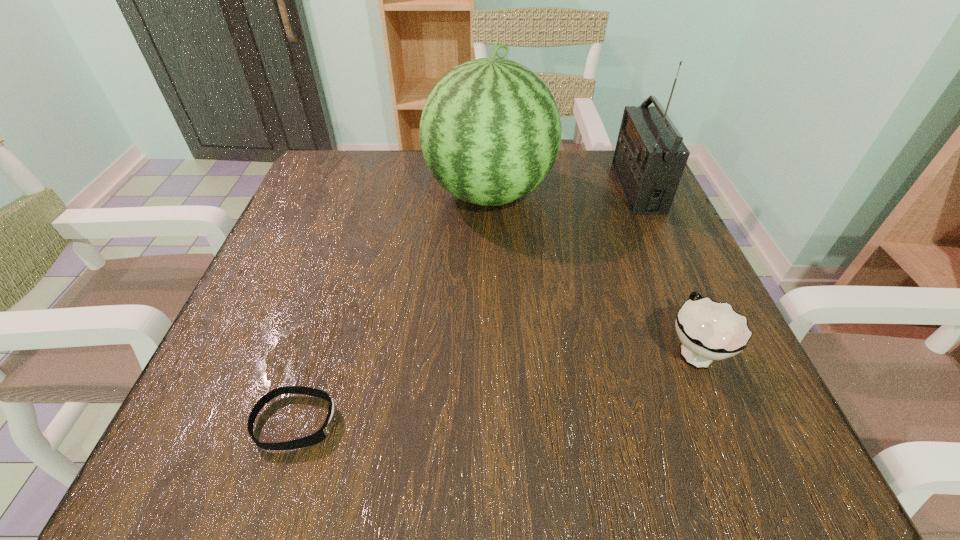
Find the location of a particular element. The image size is (960, 540). free spot between the second nearest object and the second object from left to right is located at coordinates (591, 271).

You are a GUI agent. You are given a task and a screenshot of the screen. Output one action in this format:
    pyautogui.click(x=<x>, y=<y>)
    Task: Click on the vacant space in between the watermelon and the second nearest object
    This screenshot has width=960, height=540.
    Given the screenshot: What is the action you would take?
    tap(591, 271)

Image resolution: width=960 pixels, height=540 pixels. Find the location of `empty space that is in between the third object from right to left and the third farthest object`. empty space that is in between the third object from right to left and the third farthest object is located at coordinates (591, 271).

Locate an element on the screen. The width and height of the screenshot is (960, 540). free space that is in between the nearest object and the cup is located at coordinates (494, 385).

The image size is (960, 540). In order to click on vacant region between the third tallest object and the radio receiver in this screenshot , I will do `click(665, 268)`.

Where is `free space between the radio receiver and the watermelon`? This screenshot has width=960, height=540. free space between the radio receiver and the watermelon is located at coordinates (564, 191).

Where is `the second closest object to the third farthest object`? the second closest object to the third farthest object is located at coordinates (649, 159).

Locate which object is the third closest to the radio receiver. Please provide its 2D coordinates. Your answer should be formatted as a tuple, i.e. [(x, y)], where the tuple contains the x and y coordinates of a point satisfying the conditions above.

[(322, 433)]